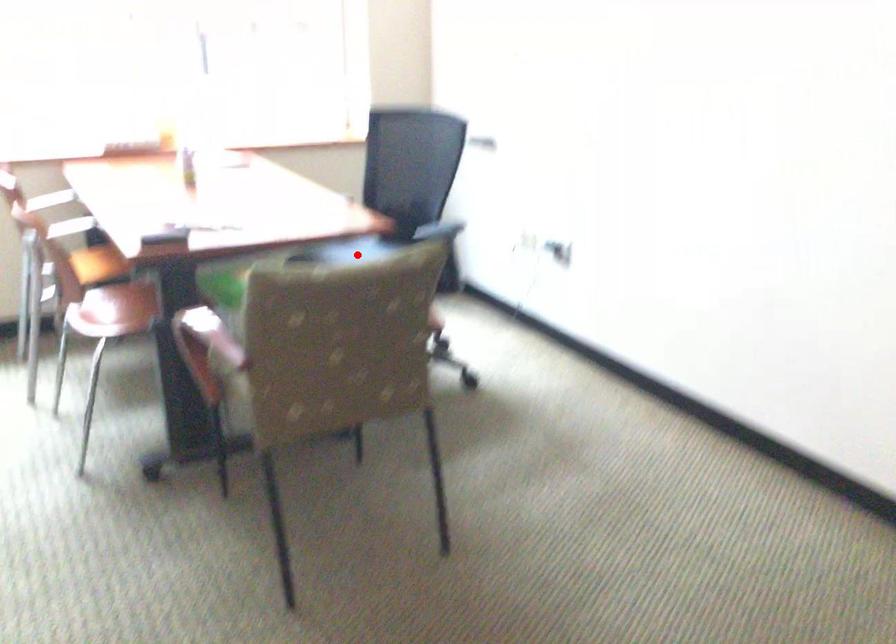
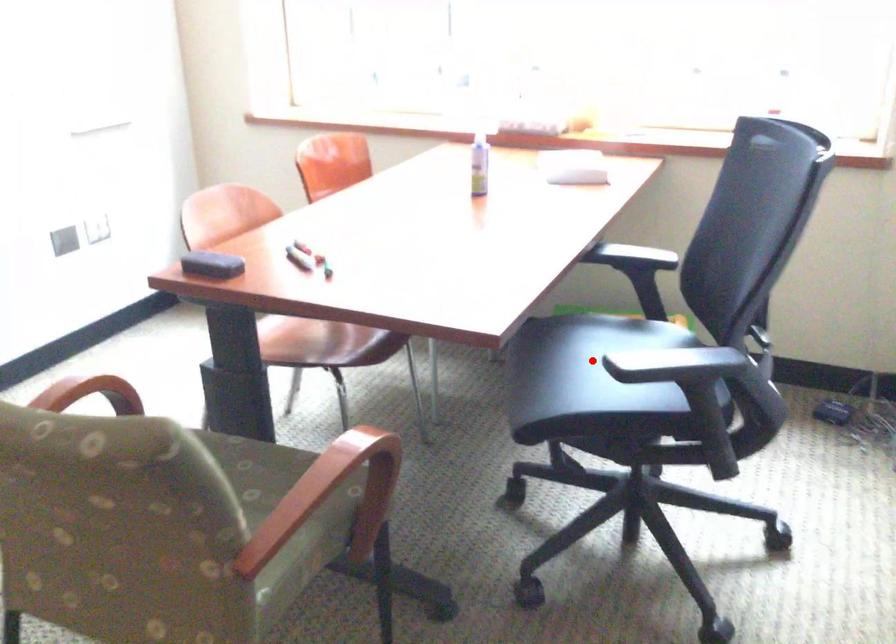
Consider the image. I am providing you with two images of the same scene from different viewpoints. A red point is marked on the first image and another point is marked on the second image. Are the points marked in image1 and image2 representing the same 3D position?

Yes